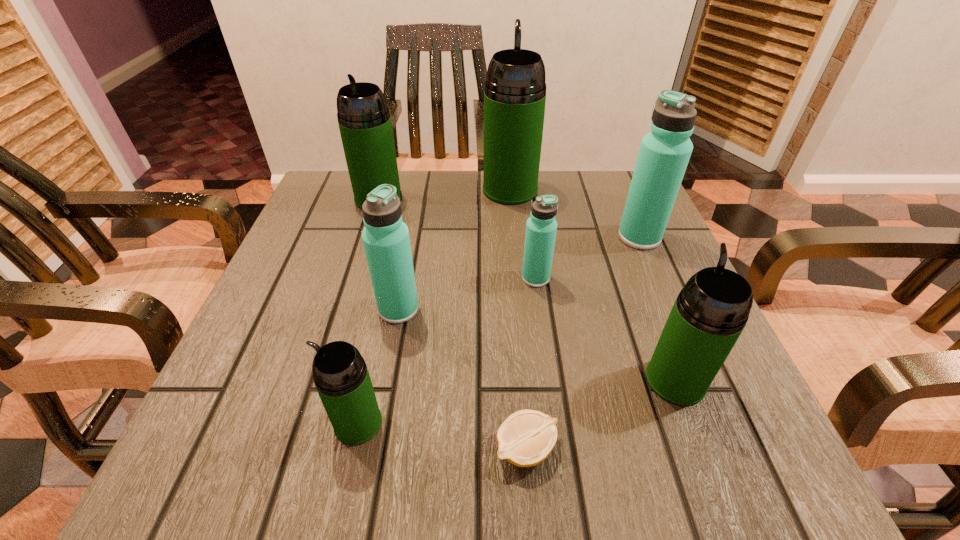
This screenshot has width=960, height=540. Find the location of `the biggest green thermos bottle`. the biggest green thermos bottle is located at coordinates (515, 90).

In order to click on the second green thermos bottle from right to left in this screenshot , I will do `click(515, 90)`.

Image resolution: width=960 pixels, height=540 pixels. I want to click on the third smallest green thermos bottle, so click(364, 120).

At what (x,y) coordinates should I click in order to perform the action: click on the farthest aqua thermos bottle. Please return your answer as a coordinate pair (x, y). This screenshot has width=960, height=540. Looking at the image, I should click on (664, 153).

The width and height of the screenshot is (960, 540). I want to click on the biggest aqua thermos bottle, so click(x=664, y=153).

Find the location of a particular element. The width and height of the screenshot is (960, 540). the rightmost green thermos bottle is located at coordinates (709, 314).

Locate an element on the screen. The image size is (960, 540). the nearest aqua thermos bottle is located at coordinates (386, 241).

The width and height of the screenshot is (960, 540). Find the location of `the fifth farthest thermos bottle`. the fifth farthest thermos bottle is located at coordinates pyautogui.click(x=386, y=241).

This screenshot has height=540, width=960. I want to click on the smallest aqua thermos bottle, so click(x=541, y=227).

Find the location of `the fourth nearest thermos bottle`. the fourth nearest thermos bottle is located at coordinates pyautogui.click(x=541, y=227).